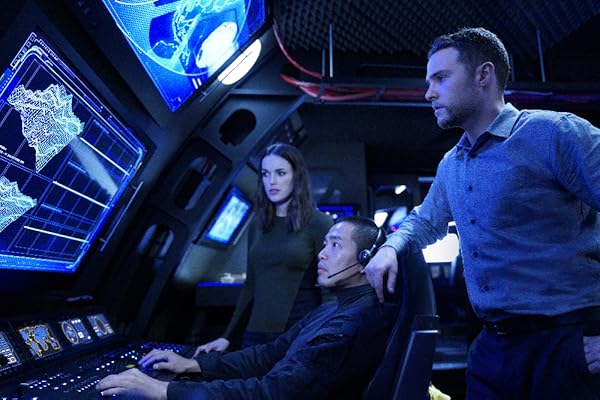
Locate an element on the screen. Image resolution: width=600 pixels, height=400 pixels. keyboard is located at coordinates (87, 383), (111, 365), (140, 347), (69, 387).